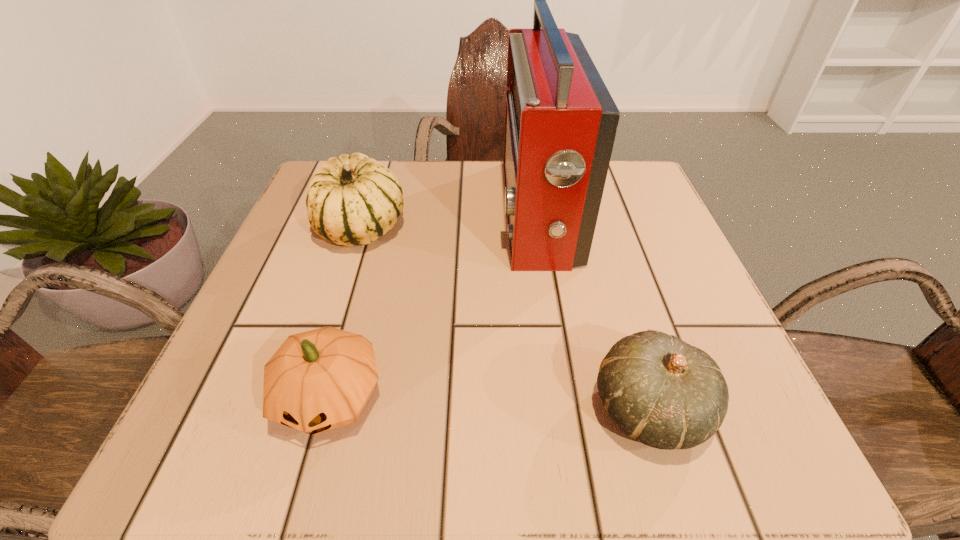
I want to click on blank area in the image that satisfies the following two spatial constraints: 1. on the front side of the second tallest object; 2. on the left side of the rightmost gourd, so click(305, 409).

Identify the location of free spot that satisfies the following two spatial constraints: 1. on the front-facing side of the rightmost gourd; 2. on the left side of the radio receiver. (567, 409).

You are a GUI agent. You are given a task and a screenshot of the screen. Output one action in this format:
    pyautogui.click(x=<x>, y=<y>)
    Task: Click on the free spot that satisfies the following two spatial constraints: 1. on the front-facing side of the tallest object; 2. on the back side of the rightmost gourd
    The width and height of the screenshot is (960, 540).
    Given the screenshot: What is the action you would take?
    pyautogui.click(x=567, y=409)

Locate an element on the screen. The height and width of the screenshot is (540, 960). blank space that satisfies the following two spatial constraints: 1. on the front-facing side of the radio receiver; 2. on the left side of the rightmost gourd is located at coordinates (567, 409).

The width and height of the screenshot is (960, 540). I want to click on free space in the image that satisfies the following two spatial constraints: 1. on the front-facing side of the radio receiver; 2. on the left side of the rightmost gourd, so click(567, 409).